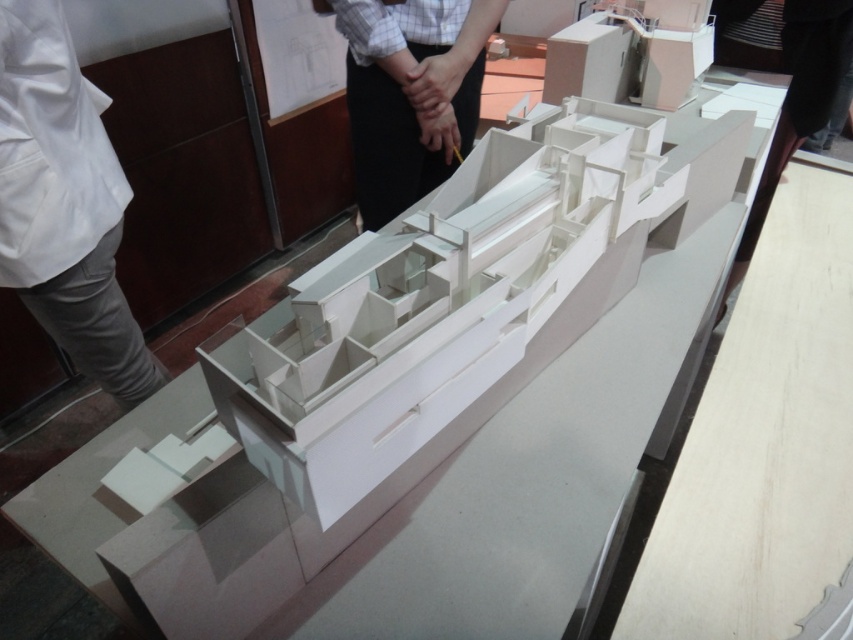
Question: Does white cotton pants at lower left have a lesser width compared to white paper at upper center?

Choices:
 (A) yes
 (B) no

Answer: (A)

Question: Is white cotton pants at lower left to the left of white paper at upper center from the viewer's perspective?

Choices:
 (A) yes
 (B) no

Answer: (A)

Question: Which object appears farthest from the camera in this image?

Choices:
 (A) white cotton pants at lower left
 (B) white paper at upper center

Answer: (B)

Question: Among these objects, which one is farthest from the camera?

Choices:
 (A) white cotton pants at lower left
 (B) white paper at upper center

Answer: (B)

Question: Among these objects, which one is farthest from the camera?

Choices:
 (A) white cotton pants at lower left
 (B) white paper at upper center

Answer: (B)

Question: Can you confirm if white cotton pants at lower left is positioned to the right of white paper at upper center?

Choices:
 (A) yes
 (B) no

Answer: (B)